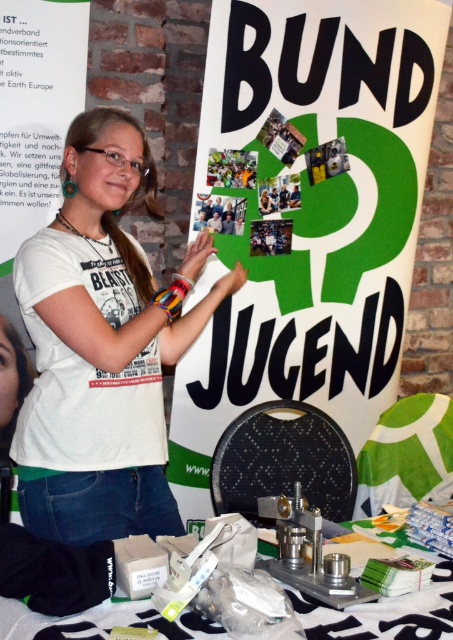
Question: In this image, where is white paperboard at center located relative to metallic silver tools at center?

Choices:
 (A) left
 (B) right

Answer: (B)

Question: Is white matte t-shirt at center smaller than metallic silver tools at center?

Choices:
 (A) yes
 (B) no

Answer: (B)

Question: Is white paperboard at center further to camera compared to white matte t-shirt at center?

Choices:
 (A) no
 (B) yes

Answer: (B)

Question: Which point is closer to the camera taking this photo?

Choices:
 (A) (188, 506)
 (B) (73, 616)
 (C) (121, 321)

Answer: (B)

Question: Estimate the real-world distances between objects in this image. Which object is farther from the metallic silver tools at center?

Choices:
 (A) white paperboard at center
 (B) white matte t-shirt at center

Answer: (A)

Question: Among these points, which one is nearest to the camera?

Choices:
 (A) click(144, 620)
 (B) click(231, 259)

Answer: (A)